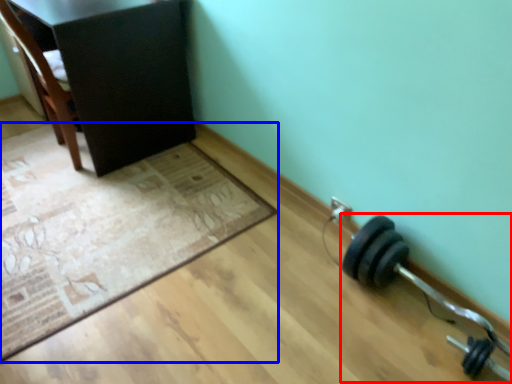
Question: Which point is closer to the camera, dumbbell (highlighted by a red box) or mat (highlighted by a blue box)?

Choices:
 (A) dumbbell
 (B) mat

Answer: (A)